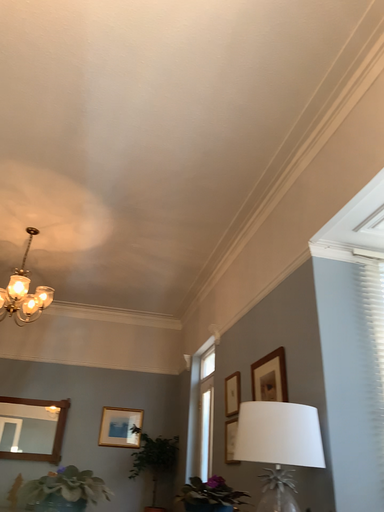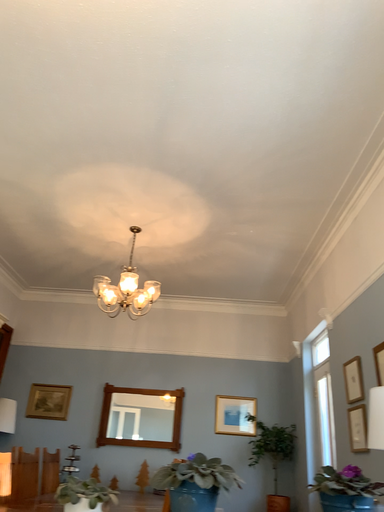
Question: How did the camera likely rotate when shooting the video?

Choices:
 (A) rotated left
 (B) rotated right

Answer: (A)